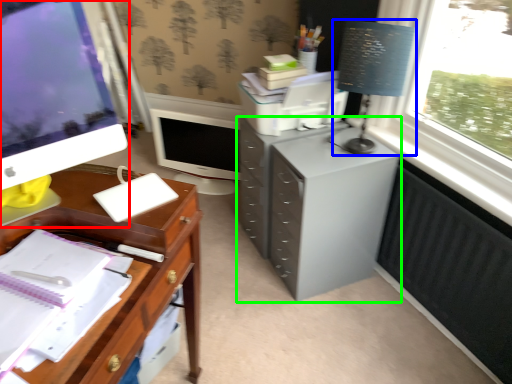
Question: Based on their relative distances, which object is nearer to computer monitor (highlighted by a red box)? Choose from table lamp (highlighted by a blue box) and filing cabinet (highlighted by a green box).

Choices:
 (A) table lamp
 (B) filing cabinet

Answer: (B)